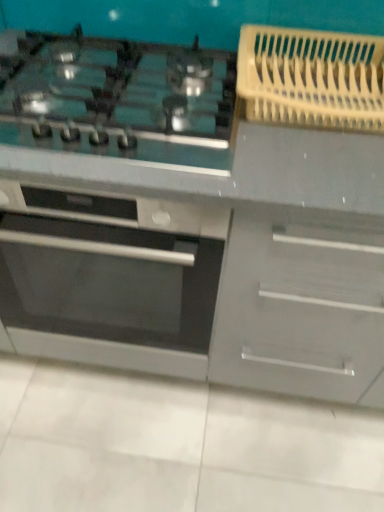
Question: From a real-world perspective, relative to satin black cooktop at upper left, is satin silver oven at center vertically above or below?

Choices:
 (A) below
 (B) above

Answer: (A)

Question: Considering the positions of satin silver oven at center and satin black cooktop at upper left in the image, is satin silver oven at center taller or shorter than satin black cooktop at upper left?

Choices:
 (A) tall
 (B) short

Answer: (A)

Question: From the image's perspective, is satin silver oven at center located above or below satin black cooktop at upper left?

Choices:
 (A) above
 (B) below

Answer: (B)

Question: Is point (188, 84) closer or farther from the camera than point (168, 351)?

Choices:
 (A) farther
 (B) closer

Answer: (B)

Question: Is satin black cooktop at upper left to the left or to the right of satin silver oven at center in the image?

Choices:
 (A) left
 (B) right

Answer: (B)

Question: From the image's perspective, is satin black cooktop at upper left located above or below satin silver oven at center?

Choices:
 (A) below
 (B) above

Answer: (B)

Question: Is satin black cooktop at upper left inside the boundaries of satin silver oven at center, or outside?

Choices:
 (A) outside
 (B) inside

Answer: (A)